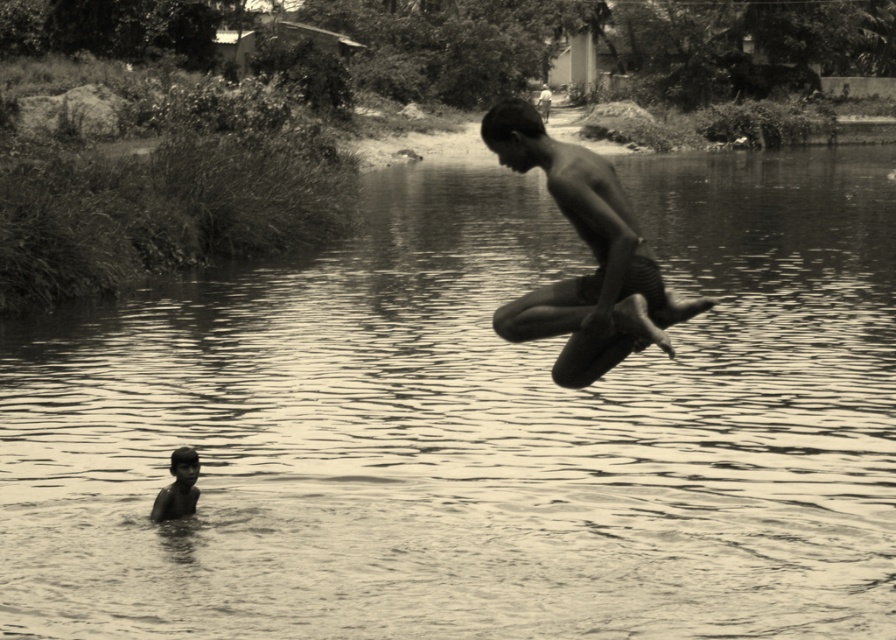
You are a photographer trying to capture a photo of the smooth skin man at center and the smooth skin child at lower left. Since the man is jumping, will the child be visible in the photo if you focus on the man?

The smooth skin man at center is positioned over smooth skin child at lower left, so the child may be partially or fully obscured in the photo if you focus on the man.

You are a photographer trying to capture the scene. You notice two points of interest labeled as point (515, 122) and point (191, 460). Which point is closer to your camera lens?

Point (515, 122) is closer to the camera than point (191, 460).